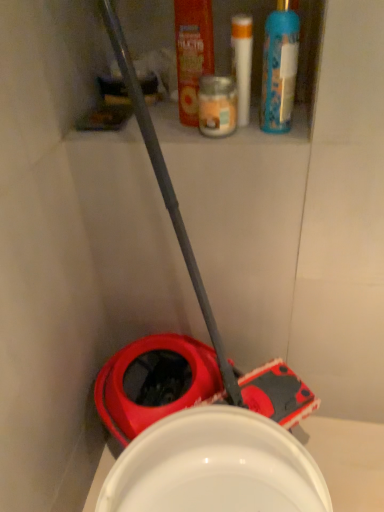
Question: In terms of width, does blue plastic spray bottle at upper right look wider or thinner when compared to translucent glass candle at upper center, the 1th toiletry when ordered from left to right?

Choices:
 (A) wide
 (B) thin

Answer: (B)

Question: Considering the positions of blue plastic spray bottle at upper right and translucent glass candle at upper center, the 1th toiletry when ordered from left to right, in the image, is blue plastic spray bottle at upper right taller or shorter than translucent glass candle at upper center, the 1th toiletry when ordered from left to right,?

Choices:
 (A) tall
 (B) short

Answer: (A)

Question: Considering the real-world distances, which object is farthest from the white plastic tube at upper center, which is counted as the second toiletry, starting from the left?

Choices:
 (A) blue plastic spray bottle at upper right
 (B) translucent glass candle at upper center, arranged as the second toiletry when viewed from the right
 (C) orange plastic mouthwash at upper center

Answer: (B)

Question: Which object is the farthest from the blue plastic spray bottle at upper right?

Choices:
 (A) white plastic tube at upper center, the 1th toiletry in the right-to-left sequence
 (B) translucent glass candle at upper center, the 1th toiletry when ordered from left to right
 (C) orange plastic mouthwash at upper center

Answer: (C)